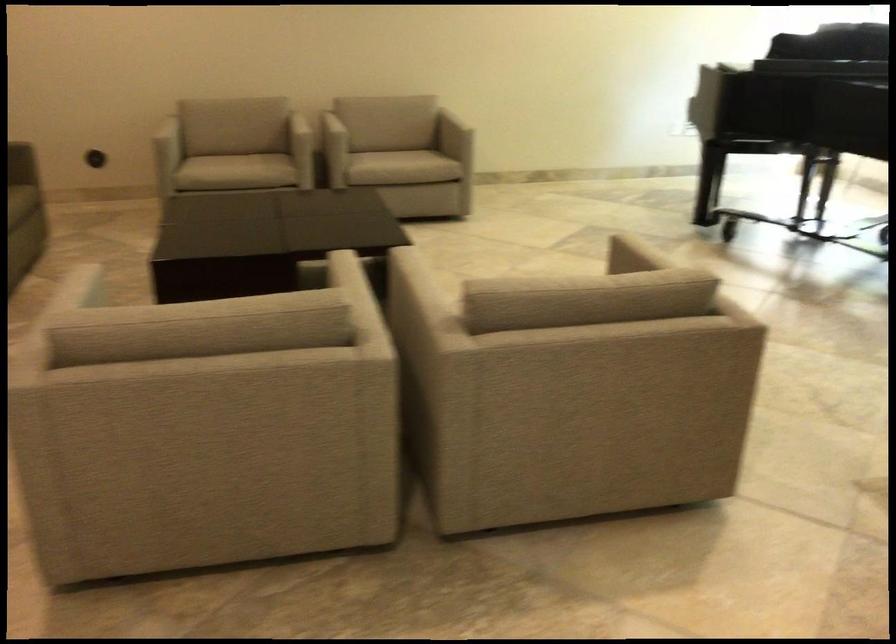
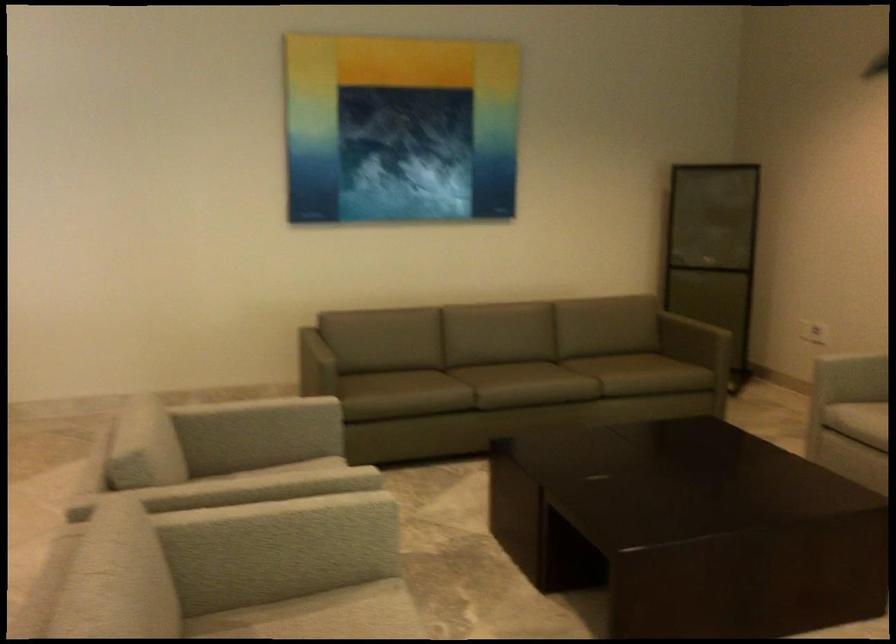
Find the pixel in the second image that matches point 349,276 in the first image.

(254, 484)